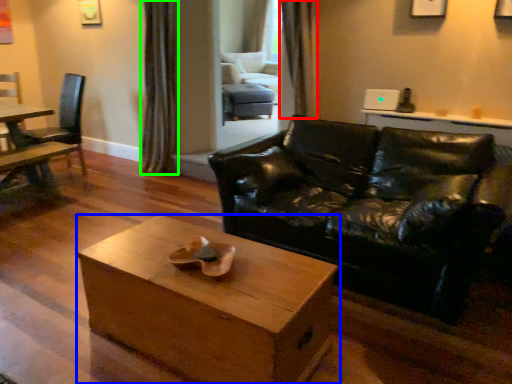
Question: Based on their relative distances, which object is nearer to curtain (highlighted by a red box)? Choose from coffee table (highlighted by a blue box) and curtain (highlighted by a green box).

Choices:
 (A) coffee table
 (B) curtain

Answer: (B)